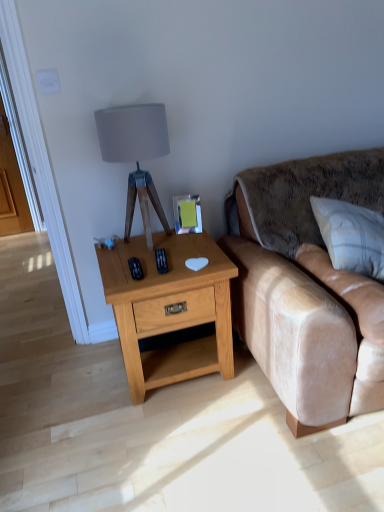
Locate an element on the screen. Image resolution: width=384 pixels, height=512 pixels. velvet beige couch at right is located at coordinates (307, 288).

This screenshot has width=384, height=512. Identify the location of white textured pillow at right. (351, 236).

Measure the distance between light oak wood nightstand at center and camera.

They are 5.33 feet apart.

The width and height of the screenshot is (384, 512). Find the location of `matte gray fabric lampshade at upper center`. matte gray fabric lampshade at upper center is located at coordinates (136, 155).

Is matte gray fabric lampshade at upper center directly adjacent to white textured pillow at right?

No, matte gray fabric lampshade at upper center is not with white textured pillow at right.

Considering the relative sizes of matte gray fabric lampshade at upper center and white textured pillow at right in the image provided, is matte gray fabric lampshade at upper center bigger than white textured pillow at right?

No.

Considering the positions of objects matte gray fabric lampshade at upper center and white textured pillow at right in the image provided, who is in front, matte gray fabric lampshade at upper center or white textured pillow at right?

white textured pillow at right is more forward.

From the image's perspective, between matte gray fabric lampshade at upper center and white textured pillow at right, which one is located above?

matte gray fabric lampshade at upper center.

Could you tell me if velvet beige couch at right is turned towards matte gray fabric lampshade at upper center?

No, velvet beige couch at right is not oriented towards matte gray fabric lampshade at upper center.

In terms of height, does velvet beige couch at right look taller or shorter compared to matte gray fabric lampshade at upper center?

Clearly, velvet beige couch at right is taller compared to matte gray fabric lampshade at upper center.

Which is further, (338, 418) or (154, 187)?

The point (154, 187) is behind.

From the image's perspective, is velvet beige couch at right located above matte gray fabric lampshade at upper center?

Incorrect, from the image's perspective, velvet beige couch at right is lower than matte gray fabric lampshade at upper center.

From a real-world perspective, is matte gray fabric lampshade at upper center positioned above or below light oak wood nightstand at center?

From a real-world perspective, matte gray fabric lampshade at upper center is physically above light oak wood nightstand at center.

Between matte gray fabric lampshade at upper center and light oak wood nightstand at center, which one is positioned in front?

light oak wood nightstand at center is more forward.

Between matte gray fabric lampshade at upper center and light oak wood nightstand at center, which one appears on the left side from the viewer's perspective?

From the viewer's perspective, matte gray fabric lampshade at upper center appears more on the left side.

Can you confirm if matte gray fabric lampshade at upper center is wider than light oak wood nightstand at center?

No, matte gray fabric lampshade at upper center is not wider than light oak wood nightstand at center.

From a real-world perspective, is velvet beige couch at right physically above light oak wood nightstand at center?

Yes, from a real-world perspective, velvet beige couch at right is over light oak wood nightstand at center

Could you tell me if velvet beige couch at right is facing light oak wood nightstand at center?

No.

Considering the sizes of velvet beige couch at right and light oak wood nightstand at center in the image, is velvet beige couch at right taller or shorter than light oak wood nightstand at center?

In the image, velvet beige couch at right appears to be taller than light oak wood nightstand at center.

From the image's perspective, which one is positioned lower, white textured pillow at right or light oak wood nightstand at center?

light oak wood nightstand at center, from the image's perspective.

Which is farther from the camera, (373, 222) or (140, 296)?

The point (373, 222) is farther from the camera.

Can you see white textured pillow at right touching light oak wood nightstand at center?

No, white textured pillow at right is not beside light oak wood nightstand at center.

Considering the relative sizes of white textured pillow at right and light oak wood nightstand at center in the image provided, is white textured pillow at right thinner than light oak wood nightstand at center?

Yes.

Is matte gray fabric lampshade at upper center inside light oak wood nightstand at center?

No, matte gray fabric lampshade at upper center is located outside of light oak wood nightstand at center.

From their relative heights in the image, would you say light oak wood nightstand at center is taller or shorter than matte gray fabric lampshade at upper center?

light oak wood nightstand at center is shorter than matte gray fabric lampshade at upper center.

Is light oak wood nightstand at center smaller than matte gray fabric lampshade at upper center?

Incorrect, light oak wood nightstand at center is not smaller in size than matte gray fabric lampshade at upper center.

From a real-world perspective, between light oak wood nightstand at center and white textured pillow at right, who is vertically higher?

white textured pillow at right, from a real-world perspective.

Does light oak wood nightstand at center have a lesser width compared to white textured pillow at right?

No, light oak wood nightstand at center is not thinner than white textured pillow at right.

Which object is more forward, light oak wood nightstand at center or white textured pillow at right?

white textured pillow at right is in front.

From the image's perspective, is light oak wood nightstand at center located above or below white textured pillow at right?

light oak wood nightstand at center is below white textured pillow at right.

This screenshot has width=384, height=512. What are the coordinates of `table lamp behind the white textured pillow at right` in the screenshot? It's located at (136, 155).

Identify the location of studio couch that is under the matte gray fabric lampshade at upper center (from a real-world perspective). The image size is (384, 512). (307, 288).

Estimate the real-world distances between objects in this image. Which object is closer to matte gray fabric lampshade at upper center, velvet beige couch at right or light oak wood nightstand at center?

light oak wood nightstand at center lies closer to matte gray fabric lampshade at upper center than the other object.

Considering their positions, is matte gray fabric lampshade at upper center positioned closer to light oak wood nightstand at center than white textured pillow at right?

matte gray fabric lampshade at upper center.

Estimate the real-world distances between objects in this image. Which object is further from light oak wood nightstand at center, velvet beige couch at right or matte gray fabric lampshade at upper center?

matte gray fabric lampshade at upper center is positioned further to the anchor light oak wood nightstand at center.

From the image, which object appears to be farther from matte gray fabric lampshade at upper center, light oak wood nightstand at center or velvet beige couch at right?

The object further to matte gray fabric lampshade at upper center is velvet beige couch at right.

Considering their positions, is light oak wood nightstand at center positioned further to white textured pillow at right than matte gray fabric lampshade at upper center?

matte gray fabric lampshade at upper center.

From the image, which object appears to be farther from white textured pillow at right, light oak wood nightstand at center or velvet beige couch at right?

The object further to white textured pillow at right is light oak wood nightstand at center.

Looking at the image, which one is located closer to velvet beige couch at right, white textured pillow at right or matte gray fabric lampshade at upper center?

white textured pillow at right is positioned closer to the anchor velvet beige couch at right.

When comparing their distances from matte gray fabric lampshade at upper center, does light oak wood nightstand at center or white textured pillow at right seem closer?

Based on the image, light oak wood nightstand at center appears to be nearer to matte gray fabric lampshade at upper center.

In order to click on nightstand between matte gray fabric lampshade at upper center and velvet beige couch at right in this screenshot , I will do `click(170, 309)`.

You are a GUI agent. You are given a task and a screenshot of the screen. Output one action in this format:
    pyautogui.click(x=<x>, y=<y>)
    Task: Click on the nightstand between matte gray fabric lampshade at upper center and white textured pillow at right
    The width and height of the screenshot is (384, 512).
    Given the screenshot: What is the action you would take?
    pyautogui.click(x=170, y=309)

Locate an element on the screen. This screenshot has height=512, width=384. pillow situated between matte gray fabric lampshade at upper center and velvet beige couch at right from left to right is located at coordinates (351, 236).

At what (x,y) coordinates should I click in order to perform the action: click on pillow between light oak wood nightstand at center and velvet beige couch at right. Please return your answer as a coordinate pair (x, y). This screenshot has height=512, width=384. Looking at the image, I should click on (351, 236).